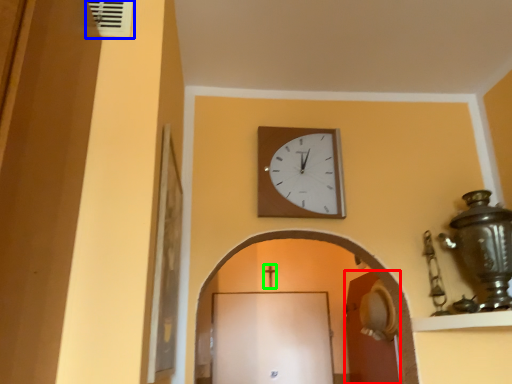
Question: Estimate the real-world distances between objects in this image. Which object is farther from door (highlighted by a red box), air conditioning (highlighted by a blue box) or crucifix (highlighted by a green box)?

Choices:
 (A) air conditioning
 (B) crucifix

Answer: (A)